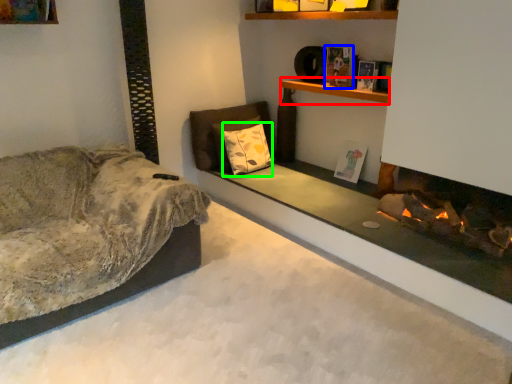
Question: Which is nearer to the shelf (highlighted by a red box)? book (highlighted by a blue box) or pillow (highlighted by a green box).

Choices:
 (A) book
 (B) pillow

Answer: (A)